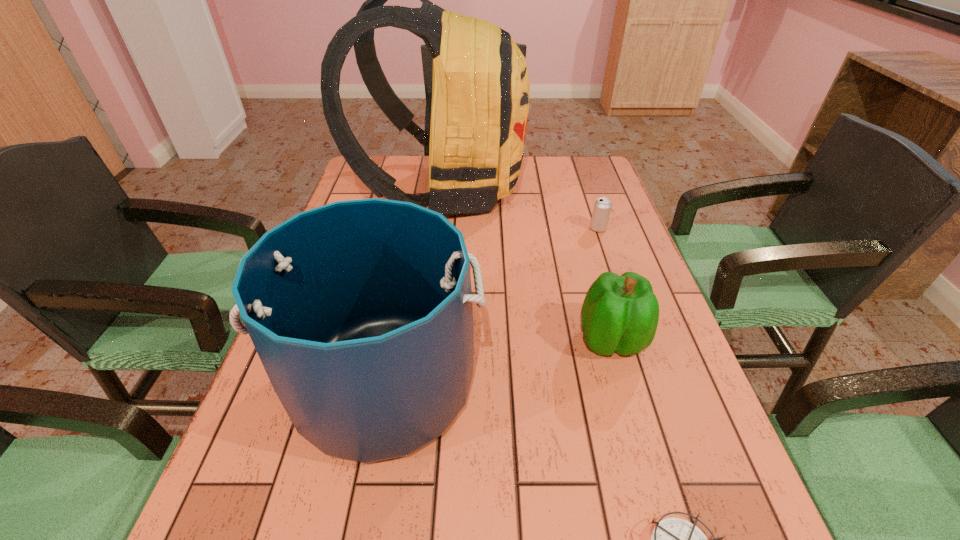
Where is `backpack`? The width and height of the screenshot is (960, 540). backpack is located at coordinates (480, 94).

Image resolution: width=960 pixels, height=540 pixels. What are the coordinates of `bucket` in the screenshot? It's located at (361, 313).

The width and height of the screenshot is (960, 540). In order to click on the third shortest object in this screenshot , I will do `click(620, 314)`.

What are the coordinates of `the second shortest object` in the screenshot? It's located at (602, 207).

I want to click on free spot located on the front-facing side of the tallest object, so click(570, 190).

Where is `vacant space situated 0.340m on the back of the bucket`? The image size is (960, 540). vacant space situated 0.340m on the back of the bucket is located at coordinates (413, 229).

Locate an element on the screen. This screenshot has width=960, height=540. vacant space located 0.300m on the front of the bell pepper is located at coordinates (664, 527).

Image resolution: width=960 pixels, height=540 pixels. Identify the location of vacant space located on the left of the beer can. click(x=481, y=228).

Where is `object that is at the far edge`? This screenshot has height=540, width=960. object that is at the far edge is located at coordinates (480, 94).

Identify the location of backpack located in the left edge section of the desktop. (480, 94).